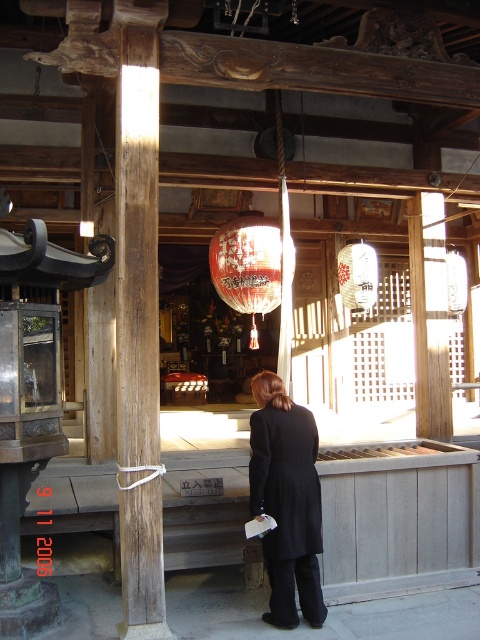
Is black wool coat at center closer to the viewer compared to red paper lantern at center?

Yes, black wool coat at center is closer to the viewer.

Does black wool coat at center appear on the right side of red paper lantern at center?

No, black wool coat at center is not to the right of red paper lantern at center.

Locate an element on the screen. black wool coat at center is located at coordinates (288, 508).

Which is in front, point (263, 509) or point (289, 256)?

Point (263, 509) is more forward.

Which is more to the left, black wool coat at center or white paper lantern at center?

From the viewer's perspective, white paper lantern at center appears more on the left side.

What do you see at coordinates (288, 508) in the screenshot? I see `black wool coat at center` at bounding box center [288, 508].

Locate an element on the screen. The width and height of the screenshot is (480, 640). black wool coat at center is located at coordinates (288, 508).

Can you confirm if weathered wood pole at left is shorter than black wool coat at center?

Incorrect, weathered wood pole at left's height does not fall short of black wool coat at center's.

Between weathered wood pole at left and black wool coat at center, which one has less height?

Standing shorter between the two is black wool coat at center.

Which is in front, point (132, 124) or point (292, 588)?

Point (292, 588) is in front.

Identify the location of weathered wood pole at left. Image resolution: width=480 pixels, height=640 pixels. (139, 317).